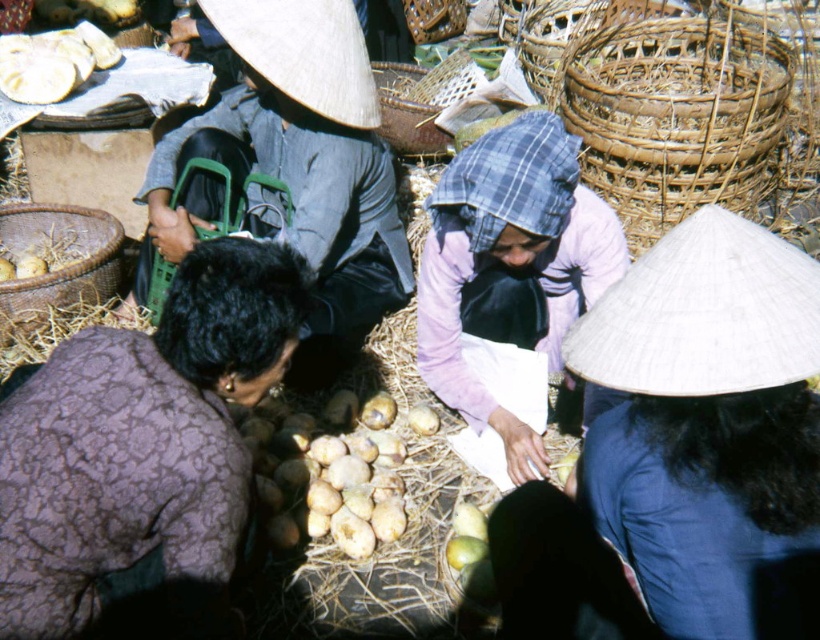
Does brown woven basket at lower left have a lesser height compared to woven bamboo basket at upper center?

No, brown woven basket at lower left is not shorter than woven bamboo basket at upper center.

Does brown woven basket at lower left have a smaller size compared to woven bamboo basket at upper center?

Incorrect, brown woven basket at lower left is not smaller in size than woven bamboo basket at upper center.

Does point (49, 294) lie behind point (431, 19)?

No, it is in front of (431, 19).

Locate an element on the screen. brown woven basket at lower left is located at coordinates (57, 260).

Where is `purple textured fabric at lower left`? purple textured fabric at lower left is located at coordinates (144, 444).

What do you see at coordinates (144, 444) in the screenshot?
I see `purple textured fabric at lower left` at bounding box center [144, 444].

Between point (162, 508) and point (615, 205), which one is positioned behind?

Point (615, 205)

The height and width of the screenshot is (640, 820). In order to click on purple textured fabric at lower left in this screenshot , I will do `click(144, 444)`.

Between woven straw basket at upper center and woven bamboo basket at upper center, which one appears on the left side from the viewer's perspective?

woven straw basket at upper center is more to the left.

Between point (388, 109) and point (404, 12), which one is positioned in front?

Positioned in front is point (388, 109).

I want to click on woven straw basket at upper center, so click(408, 112).